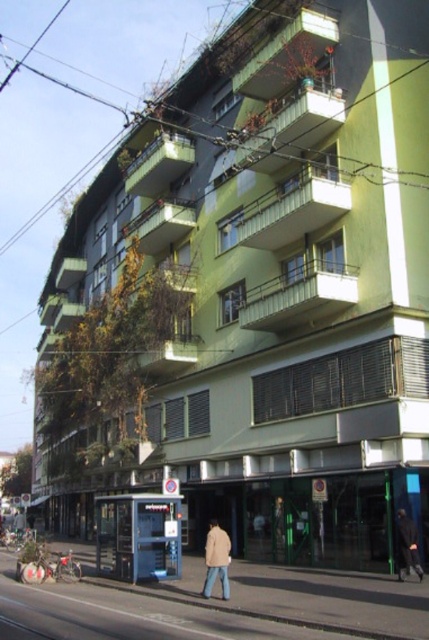
Question: Among these points, which one is farthest from the camera?

Choices:
 (A) (211, 556)
 (B) (398, 541)

Answer: (B)

Question: From the image, what is the correct spatial relationship of beige fabric jacket at lower center in relation to dark fabric jacket at lower right?

Choices:
 (A) right
 (B) left

Answer: (B)

Question: Does beige fabric jacket at lower center lie in front of dark fabric jacket at lower right?

Choices:
 (A) yes
 (B) no

Answer: (A)

Question: Which of the following is the closest to the observer?

Choices:
 (A) dark fabric jacket at lower right
 (B) beige fabric jacket at lower center

Answer: (B)

Question: Can you confirm if beige fabric jacket at lower center is positioned above dark fabric jacket at lower right?

Choices:
 (A) no
 (B) yes

Answer: (A)